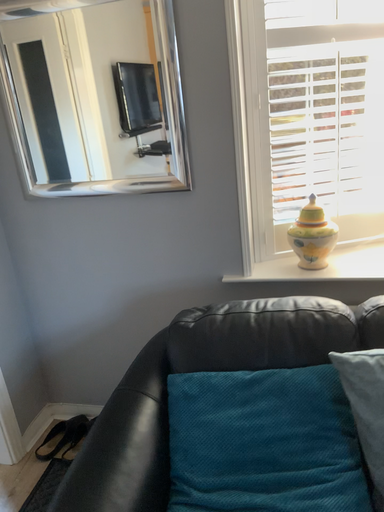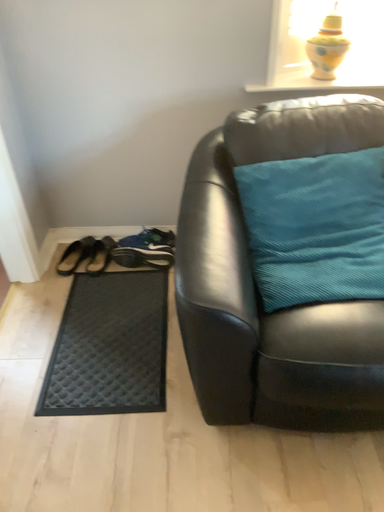
Question: Which way did the camera rotate in the video?

Choices:
 (A) rotated left
 (B) rotated right

Answer: (B)